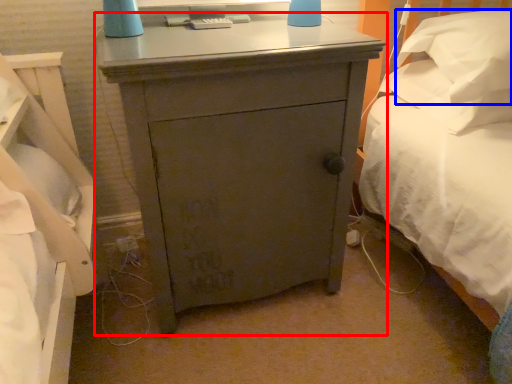
Question: Which object is closer to the camera taking this photo, nightstand (highlighted by a red box) or pillow (highlighted by a blue box)?

Choices:
 (A) nightstand
 (B) pillow

Answer: (A)